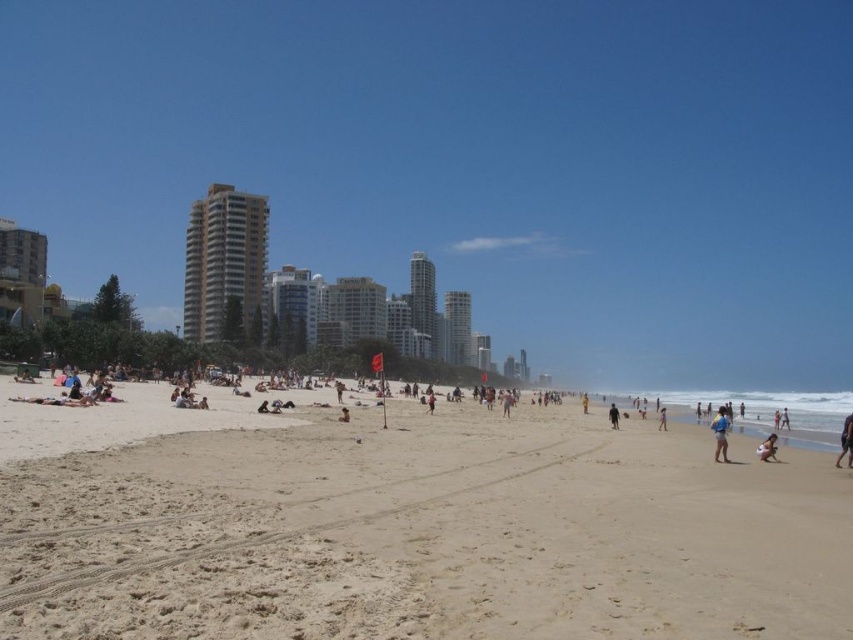
Between point (712, 426) and point (762, 448), which one is positioned behind?

Point (712, 426)

Can you confirm if white cotton shirt at lower right is thinner than light brown sand at lower right?

Incorrect, white cotton shirt at lower right's width is not less than light brown sand at lower right's.

Between point (714, 451) and point (757, 451), which one is positioned in front?

Point (757, 451) is in front.

Find the location of a particular element. This screenshot has height=640, width=853. white cotton shirt at lower right is located at coordinates (720, 433).

Does white cotton shirt at lower right appear under purple fabric at lower right?

Yes.

Image resolution: width=853 pixels, height=640 pixels. I want to click on white cotton shirt at lower right, so click(720, 433).

Does point (724, 419) lie behind point (845, 445)?

Yes, it is.

Locate an element on the screen. This screenshot has width=853, height=640. white cotton shirt at lower right is located at coordinates click(x=720, y=433).

Between light brown sand at center and purple fabric at lower right, which one is positioned higher?

light brown sand at center is higher up.

Which is behind, point (770, 560) or point (846, 451)?

Positioned behind is point (846, 451).

Identify the location of light brown sand at center. The height and width of the screenshot is (640, 853). (407, 524).